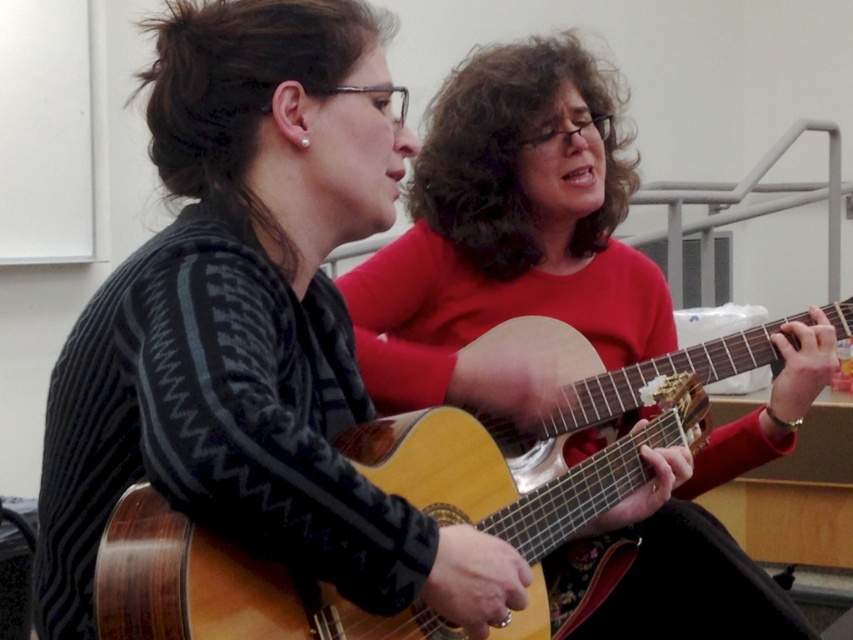
Who is higher up, matte wood guitar at center or wooden acoustic guitar at center?

matte wood guitar at center is above.

Describe the element at coordinates (508, 236) in the screenshot. Image resolution: width=853 pixels, height=640 pixels. I see `matte wood guitar at center` at that location.

Who is more distant from viewer, (579,161) or (555,419)?

Point (579,161)

Locate an element on the screen. This screenshot has width=853, height=640. matte wood guitar at center is located at coordinates (508, 236).